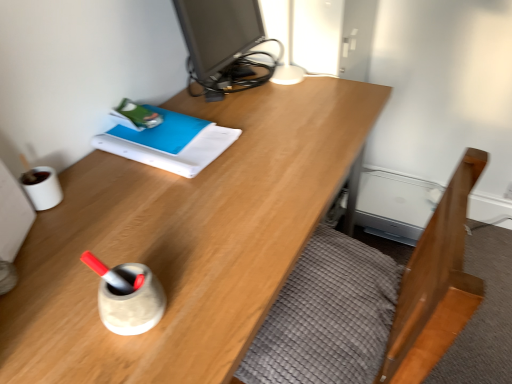
This screenshot has width=512, height=384. Identify the location of free space above blue matte book at upper left (from a real-world perspective). (163, 138).